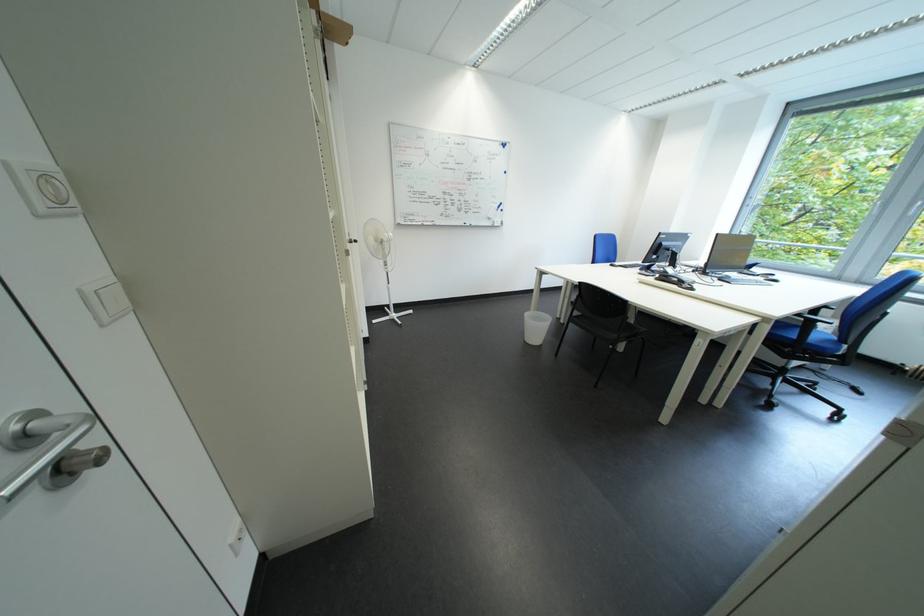
The height and width of the screenshot is (616, 924). I want to click on white dimmer switch, so click(53, 188).